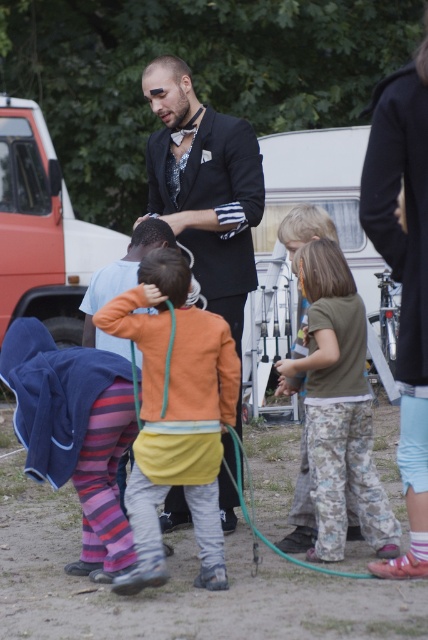
Between orange cotton shirt at center and black satin suit at center, which one has more height?

With more height is black satin suit at center.

Who is more distant from viewer, (181, 364) or (232, 461)?

Positioned behind is point (232, 461).

Does point (172, 448) come in front of point (244, 237)?

Yes, it is in front of point (244, 237).

At what (x,y) coordinates should I click in order to perform the action: click on orange cotton shirt at center. Please return your answer as a coordinate pair (x, y). This screenshot has height=640, width=428. Looking at the image, I should click on (175, 416).

Who is more forward, (166, 179) or (250, 522)?

Point (250, 522) is in front.

Who is more distant from viewer, (250, 131) or (344, 577)?

The point (250, 131) is more distant.

This screenshot has height=640, width=428. Identify the location of black satin suit at center. (205, 186).

Based on the photo, is orange cotton shirt at center to the left of matte white van at left from the viewer's perspective?

No, orange cotton shirt at center is not to the left of matte white van at left.

You are a GUI agent. You are given a task and a screenshot of the screen. Output one action in this format:
    pyautogui.click(x=<x>, y=<y>)
    Task: Click on the orange cotton shirt at center
    The height and width of the screenshot is (640, 428).
    Given the screenshot: What is the action you would take?
    coord(175,416)